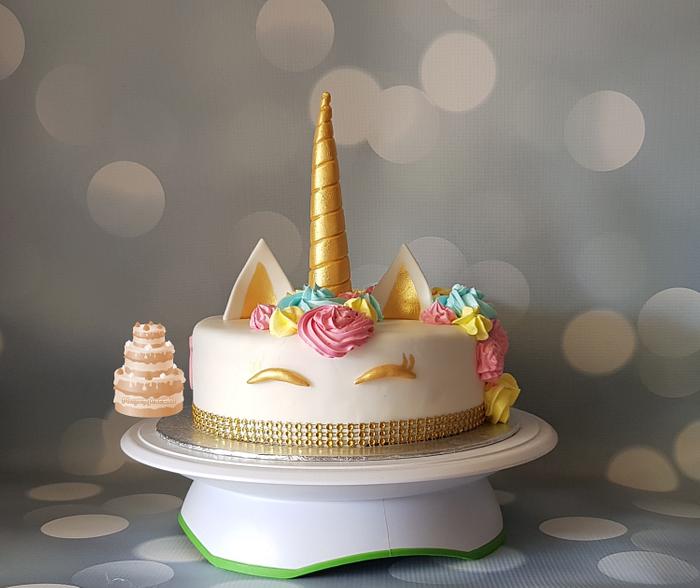
Locate an element on the screen. The height and width of the screenshot is (588, 700). white cake stand base is located at coordinates (318, 527).